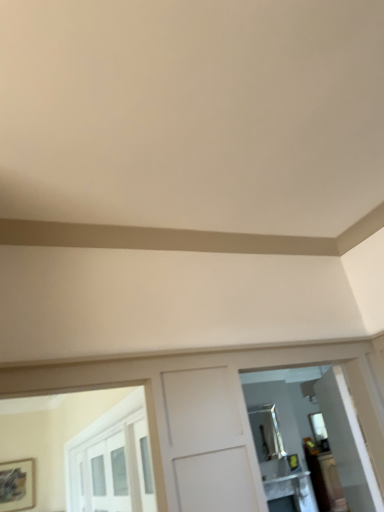
Question: Considering the positions of point (291, 476) and point (256, 375), is point (291, 476) closer or farther from the camera than point (256, 375)?

Choices:
 (A) farther
 (B) closer

Answer: (A)

Question: From the image's perspective, is white glossy table at lower right above or below matte silver mirror at right, the 2th mirror in the bottom-to-top sequence?

Choices:
 (A) above
 (B) below

Answer: (B)

Question: Considering the real-world distances, which object is closest to the matte silver mirror at right, placed as the 1th mirror when sorted from top to bottom?

Choices:
 (A) white glossy table at lower right
 (B) matte black picture frame at lower left
 (C) silver metallic mirror at upper center, the first mirror in the back-to-front sequence

Answer: (A)

Question: Which object is the farthest from the matte black picture frame at lower left?

Choices:
 (A) silver metallic mirror at upper center, which is the 1th mirror from bottom to top
 (B) white glossy table at lower right
 (C) matte silver mirror at right, placed as the second mirror when sorted from back to front

Answer: (C)